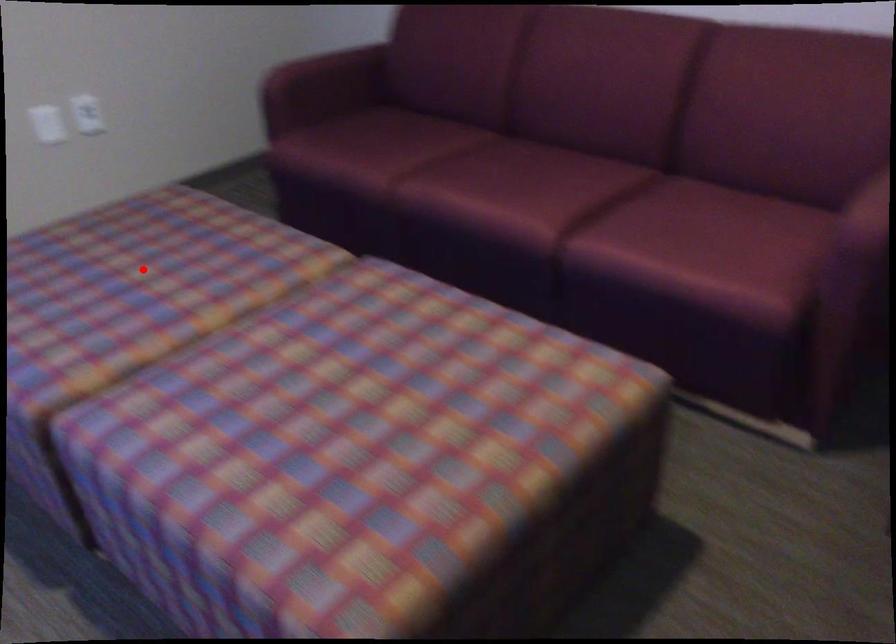
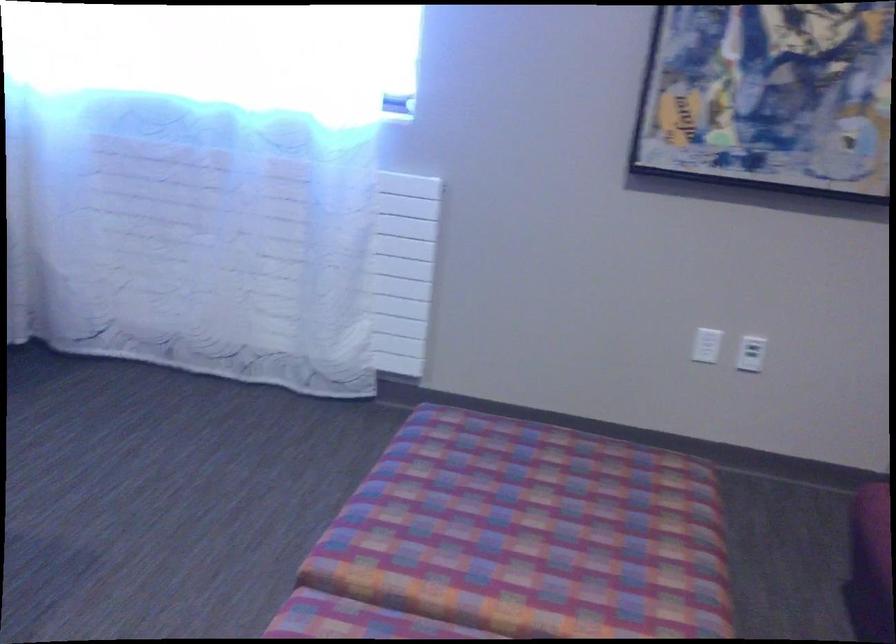
Question: I am providing you with two images of the same scene from different viewpoints. A red point is marked on the first image. Is the red point's position out of view in image 2?

Choices:
 (A) Yes
 (B) No

Answer: (B)